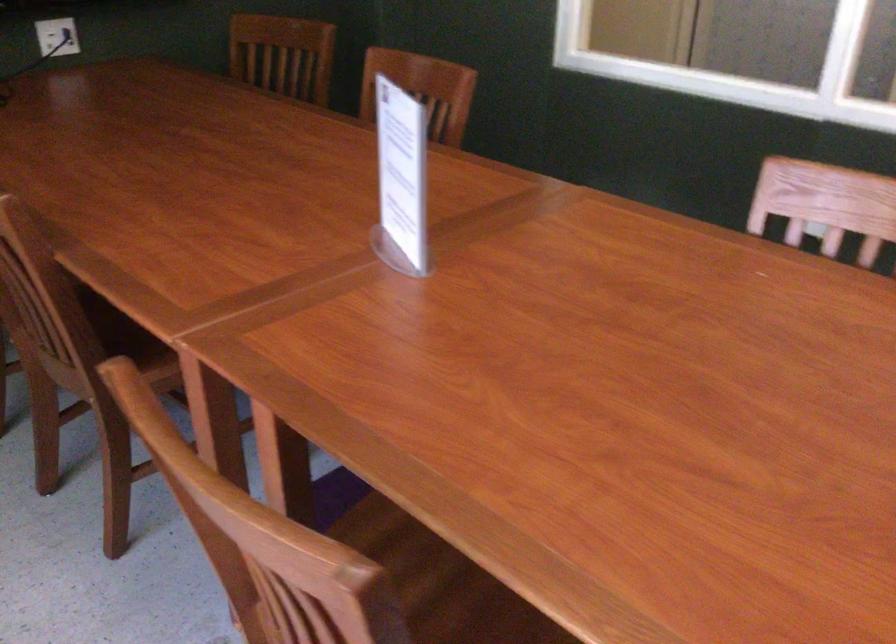
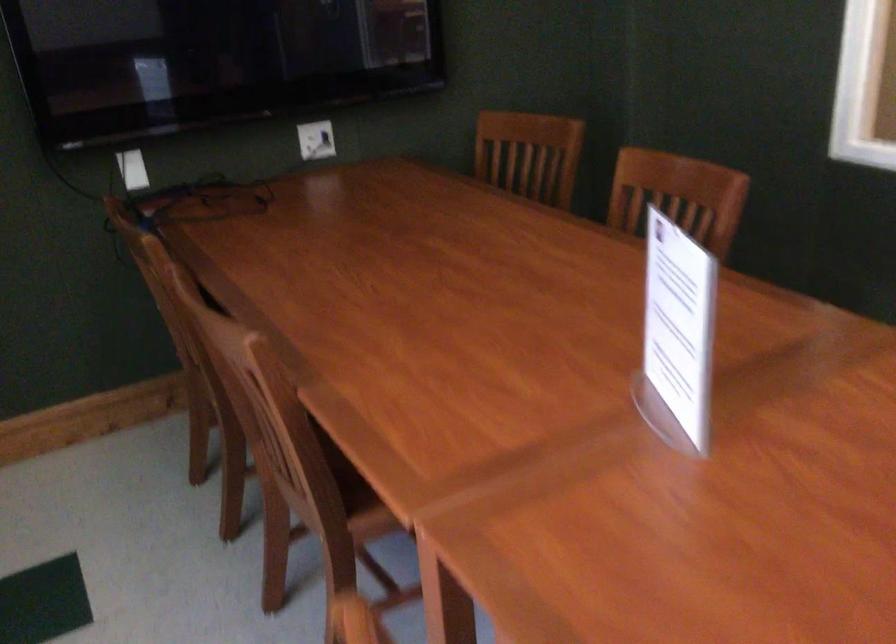
Question: The images are taken continuously from a first-person perspective. In which direction is your viewpoint rotating?

Choices:
 (A) Left
 (B) Right
 (C) Up
 (D) Down

Answer: (A)